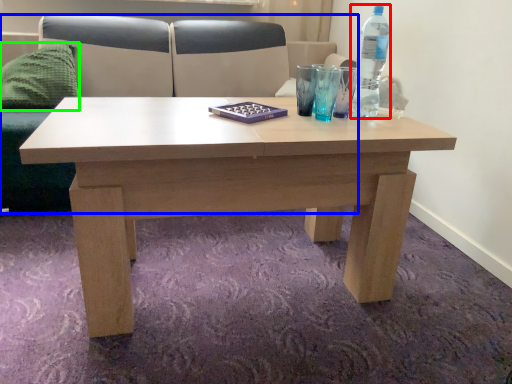
Question: Which object is positioned closest to bottle (highlighted by a red box)? Select from couch (highlighted by a blue box) and pillow (highlighted by a green box).

Choices:
 (A) couch
 (B) pillow

Answer: (A)